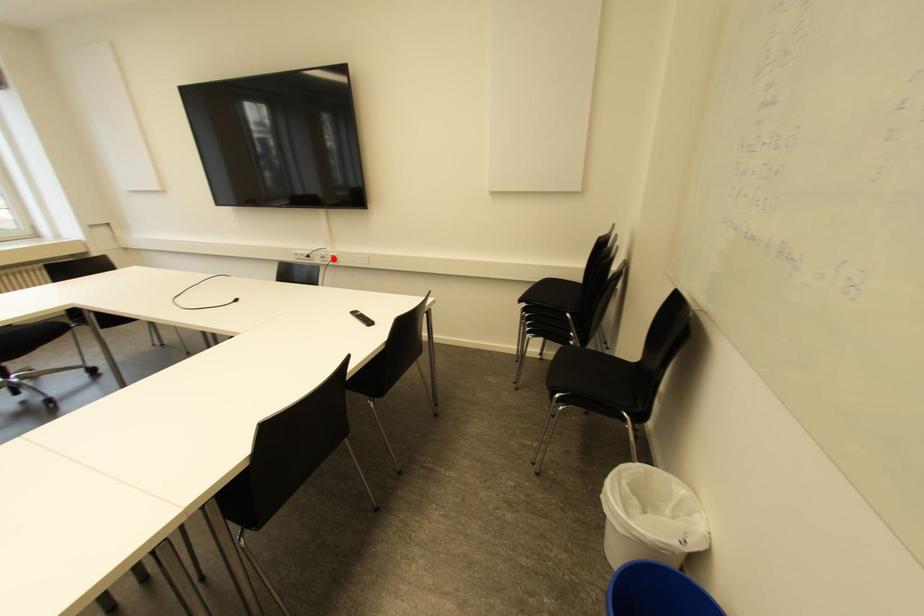
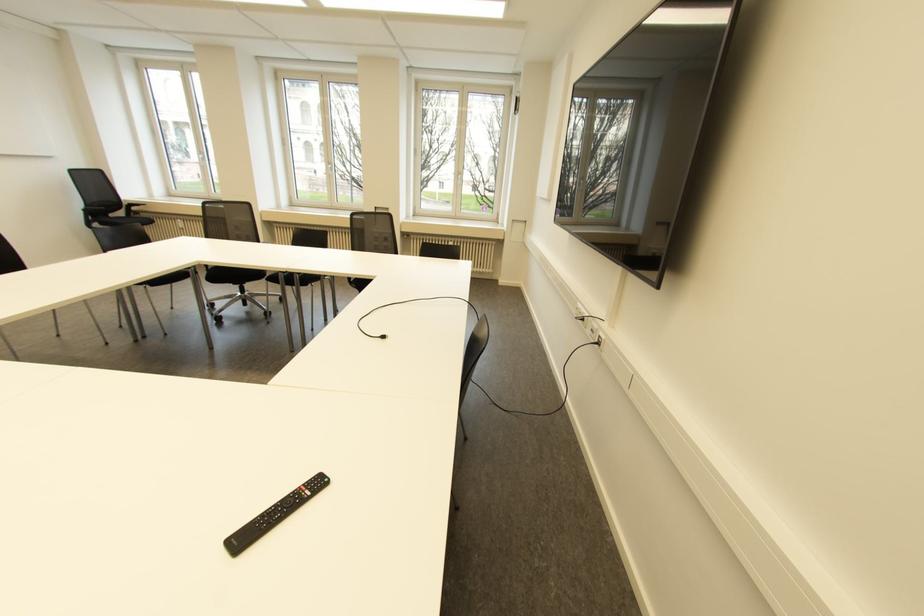
Find the pixel in the second image that matches the highlighted location in the first image.

(598, 342)